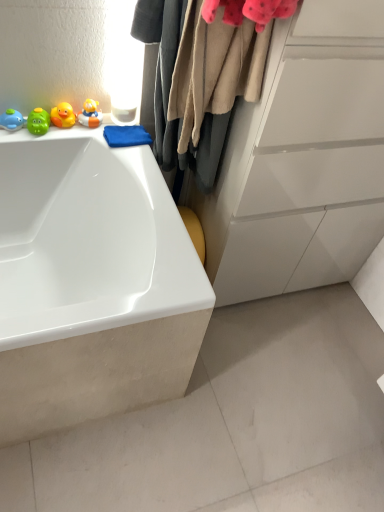
Question: Does point (246, 74) appear closer or farther from the camera than point (89, 125)?

Choices:
 (A) closer
 (B) farther

Answer: (A)

Question: From a real-world perspective, is beige woolen sweater at upper center above or below rubber duck at upper left, the 4th toy in the left-to-right sequence?

Choices:
 (A) above
 (B) below

Answer: (A)

Question: Which object is the farthest from the rubber duck at upper left, the 4th toy in the left-to-right sequence?

Choices:
 (A) white glossy bathtub at upper left
 (B) blue microfiber cloth at upper left
 (C) beige woolen sweater at upper center
 (D) matte blue whale at upper left, which ranks as the 1th toy in left-to-right order
 (E) rubber duck at left, which is the second toy in right-to-left order

Answer: (A)

Question: Which is farther from the white glossy bathtub at upper left?

Choices:
 (A) blue microfiber cloth at upper left
 (B) matte blue whale at upper left, which ranks as the 1th toy in left-to-right order
 (C) rubber duck at upper left, the 4th toy in the left-to-right sequence
 (D) rubber duck at left, which is counted as the 3th toy, starting from the left
 (E) beige woolen sweater at upper center

Answer: (B)